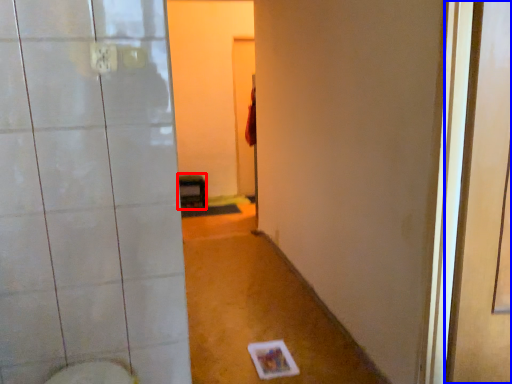
Question: Which object appears closest to the camera in this image, furniture (highlighted by a red box) or screen door (highlighted by a blue box)?

Choices:
 (A) furniture
 (B) screen door

Answer: (B)